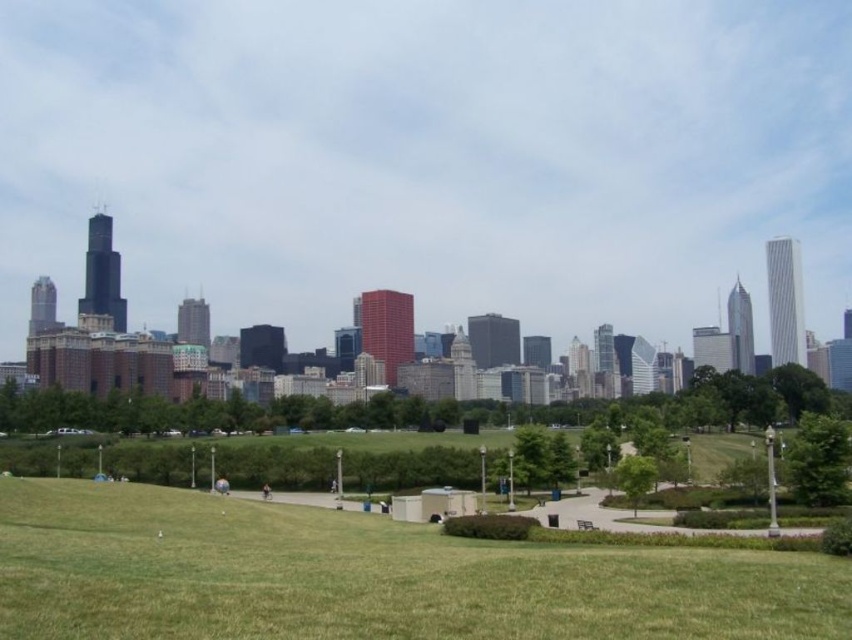
Question: Can you confirm if green grassy field at center is thinner than brown leather jacket at lower center?

Choices:
 (A) no
 (B) yes

Answer: (A)

Question: Estimate the real-world distances between objects in this image. Which object is farther from the green grassy field at center?

Choices:
 (A) brown leather jacket at lower center
 (B) matte glass skyscrapers at upper center
 (C) dark blue jeans at center

Answer: (B)

Question: Does green grassy field at center have a larger size compared to dark blue jeans at center?

Choices:
 (A) yes
 (B) no

Answer: (A)

Question: Which object appears closest to the camera in this image?

Choices:
 (A) brown leather jacket at lower center
 (B) green grassy field at center

Answer: (B)

Question: Estimate the real-world distances between objects in this image. Which object is farther from the matte glass skyscrapers at upper center?

Choices:
 (A) brown leather jacket at lower center
 (B) green grassy field at center

Answer: (A)

Question: Does brown leather jacket at lower center appear over dark blue jeans at center?

Choices:
 (A) no
 (B) yes

Answer: (B)